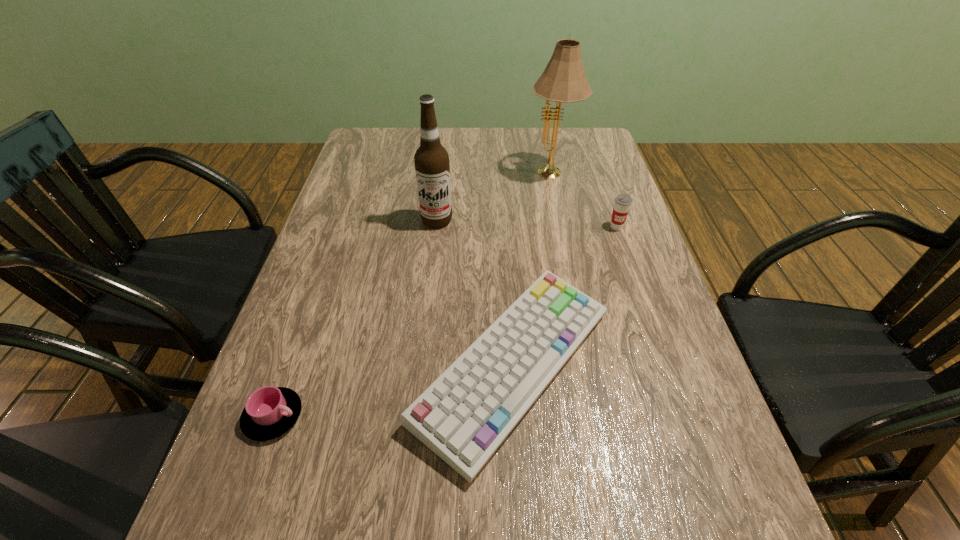
The height and width of the screenshot is (540, 960). What are the coordinates of `lampshade` in the screenshot? It's located at (563, 81).

You are a GUI agent. You are given a task and a screenshot of the screen. Output one action in this format:
    pyautogui.click(x=<x>, y=<y>)
    Task: Click on the farthest object
    This screenshot has height=540, width=960.
    Given the screenshot: What is the action you would take?
    pyautogui.click(x=563, y=81)

What are the coordinates of `the second tallest object` in the screenshot? It's located at (432, 165).

Where is `the taller cup`? the taller cup is located at coordinates (622, 202).

The image size is (960, 540). Find the location of `the rightmost object`. the rightmost object is located at coordinates (622, 202).

Where is `computer keyboard`? computer keyboard is located at coordinates (464, 416).

Locate an element on the screen. This screenshot has width=960, height=540. the shorter cup is located at coordinates (269, 412).

Find the location of `the left cup`. the left cup is located at coordinates (269, 412).

In order to click on vacant space located 0.230m on the front of the farthest object in this screenshot , I will do `click(565, 240)`.

This screenshot has height=540, width=960. I want to click on vacant space located 0.380m on the label of the alcohol, so click(422, 348).